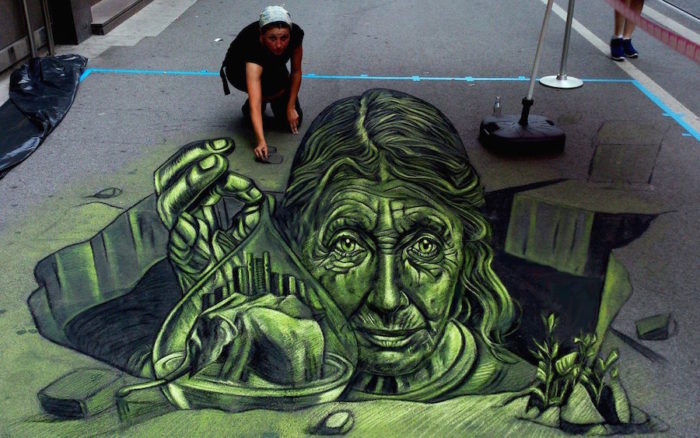
Identify the location of outline area on floor around art. This screenshot has width=700, height=438. point(176,74).